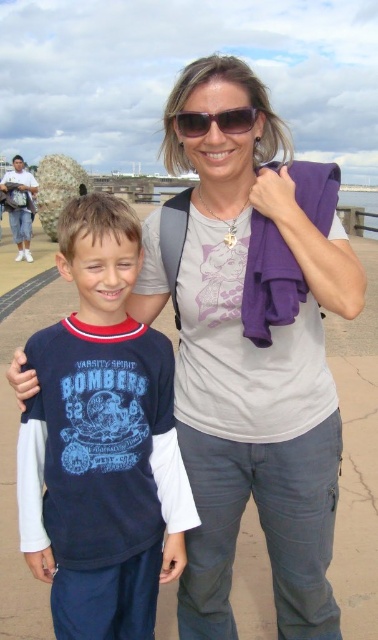
Question: Does matte blue t-shirt at center have a lesser width compared to sunglasses at upper center?

Choices:
 (A) yes
 (B) no

Answer: (B)

Question: Is matte blue t-shirt at center to the right of sunglasses at upper center from the viewer's perspective?

Choices:
 (A) yes
 (B) no

Answer: (B)

Question: Which point is closer to the camera?

Choices:
 (A) (255, 108)
 (B) (66, 371)

Answer: (B)

Question: Which object is closer to the camera taking this photo?

Choices:
 (A) matte blue t-shirt at center
 (B) sunglasses at upper center

Answer: (A)

Question: Can you confirm if matte blue t-shirt at center is positioned below sunglasses at upper center?

Choices:
 (A) no
 (B) yes

Answer: (B)

Question: Which point is farther from the camera taking this photo?

Choices:
 (A) (134, 508)
 (B) (181, 134)

Answer: (B)